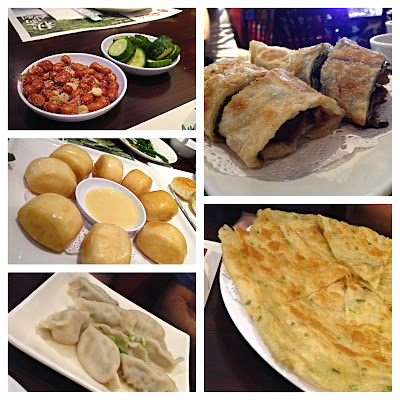
You are a GUI agent. You are given a task and a screenshot of the screen. Output one action in this format:
    pyautogui.click(x=<x>, y=<y>)
    Task: Click on the tissue
    
    Given the screenshot: What is the action you would take?
    pyautogui.click(x=224, y=160)